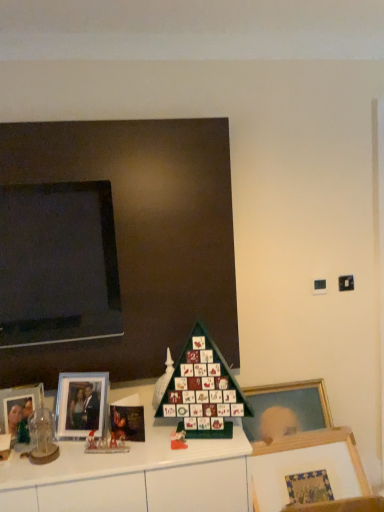
The image size is (384, 512). What are the coordinates of `green matte advent calendar at center` in the screenshot? It's located at (203, 389).

The height and width of the screenshot is (512, 384). What do you see at coordinates (19, 405) in the screenshot? I see `matte glass picture frame at left, acting as the 3th picture frame starting from the right` at bounding box center [19, 405].

What are the coordinates of `green plastic advent calendar at center` in the screenshot? It's located at (133, 474).

Image resolution: width=384 pixels, height=512 pixels. What do you see at coordinates (305, 466) in the screenshot?
I see `wooden picture frame at lower right, placed as the first picture frame when sorted from right to left` at bounding box center [305, 466].

You are a GUI agent. You are given a task and a screenshot of the screen. Output one action in this format:
    pyautogui.click(x=<x>, y=<y>)
    Task: Click on the green matte advent calendar at center, which is counted as the second toy, starting from the right
    
    Given the screenshot: What is the action you would take?
    pyautogui.click(x=163, y=381)

What do you see at coordinates (42, 438) in the screenshot?
I see `clear glass dome at left, which appears as the 1th toy when viewed from the front` at bounding box center [42, 438].

In order to face matte plastic advent calendar at center, the 2th toy positioned from the front, should I rotate leftwards or rightwards?

Turn left approximately 1.716 degrees to face it.

The width and height of the screenshot is (384, 512). Find the location of `green matte advent calendar at center`. green matte advent calendar at center is located at coordinates (203, 389).

Between matte plastic advent calendar at center, the 2th toy positioned from the front, and green matte advent calendar at center, the 2th toy positioned from the left, which one appears on the left side from the viewer's perspective?

From the viewer's perspective, green matte advent calendar at center, the 2th toy positioned from the left, appears more on the left side.

From a real-world perspective, count 2nd toys downward from the green matte advent calendar at center, the 2th toy positioned from the left, and point to it. Please provide its 2D coordinates.

[(179, 438)]

How many degrees apart are the facing directions of matte plastic advent calendar at center, the second toy viewed from the back, and green matte advent calendar at center, the third toy viewed from the front?

The angle between the facing direction of matte plastic advent calendar at center, the second toy viewed from the back, and the facing direction of green matte advent calendar at center, the third toy viewed from the front, is 13 degrees.

From the image's perspective, is matte plastic advent calendar at center, the 3th toy when ordered from left to right, located above green matte advent calendar at center, the 2th toy positioned from the left?

Actually, matte plastic advent calendar at center, the 3th toy when ordered from left to right, appears below green matte advent calendar at center, the 2th toy positioned from the left, in the image.

In the scene shown: Considering the relative positions of green matte advent calendar at center, the 2th toy positioned from the left, and clear glass dome at left, which appears as the 1th toy when viewed from the front, in the image provided, is green matte advent calendar at center, the 2th toy positioned from the left, in front of clear glass dome at left, which appears as the 1th toy when viewed from the front,?

That is False.

Which object is positioned more to the left, green matte advent calendar at center, which is counted as the second toy, starting from the right, or clear glass dome at left, arranged as the 3th toy when viewed from the right?

From the viewer's perspective, clear glass dome at left, arranged as the 3th toy when viewed from the right, appears more on the left side.

Is clear glass dome at left, arranged as the 3th toy when viewed from the right, located within green matte advent calendar at center, which is counted as the second toy, starting from the right?

No, clear glass dome at left, arranged as the 3th toy when viewed from the right, is not inside green matte advent calendar at center, which is counted as the second toy, starting from the right.

I want to click on toy that is the 1st one below the green matte advent calendar at center, which is counted as the second toy, starting from the right (from a real-world perspective), so click(42, 438).

Considering the sizes of matte black board at upper left and matte glass picture frame at left, acting as the 3th picture frame starting from the right, in the image, is matte black board at upper left wider or thinner than matte glass picture frame at left, acting as the 3th picture frame starting from the right,?

Considering their sizes, matte black board at upper left looks broader than matte glass picture frame at left, acting as the 3th picture frame starting from the right.

Is matte black board at upper left aimed at matte glass picture frame at left, acting as the 3th picture frame starting from the right?

Yes, matte black board at upper left is turned towards matte glass picture frame at left, acting as the 3th picture frame starting from the right.

From a real-world perspective, relative to matte glass picture frame at left, positioned as the first picture frame in left-to-right order, is matte black board at upper left vertically above or below?

Clearly, from a real-world perspective, matte black board at upper left is above matte glass picture frame at left, positioned as the first picture frame in left-to-right order.

This screenshot has width=384, height=512. What are the coordinates of `bulletin board behind the matte glass picture frame at left, acting as the 3th picture frame starting from the right` in the screenshot? It's located at (140, 236).

Is matte plastic advent calendar at center, which ranks as the 1th toy in right-to-left order, inside the boundaries of matte black board at upper left, or outside?

matte plastic advent calendar at center, which ranks as the 1th toy in right-to-left order, is outside matte black board at upper left.

How different are the orientations of matte plastic advent calendar at center, the second toy viewed from the back, and matte black board at upper left in degrees?

matte plastic advent calendar at center, the second toy viewed from the back, and matte black board at upper left are facing 13.9 degrees away from each other.

Which is in front, matte plastic advent calendar at center, which ranks as the 1th toy in right-to-left order, or matte black board at upper left?

matte plastic advent calendar at center, which ranks as the 1th toy in right-to-left order, is more forward.

Considering the relative sizes of matte plastic advent calendar at center, which ranks as the 1th toy in right-to-left order, and matte black board at upper left in the image provided, is matte plastic advent calendar at center, which ranks as the 1th toy in right-to-left order, taller than matte black board at upper left?

No.

Which is closer to the camera, (176, 441) or (20, 494)?

Point (176, 441).

Is matte plastic advent calendar at center, which ranks as the 1th toy in right-to-left order, bigger than green plastic advent calendar at center?

Actually, matte plastic advent calendar at center, which ranks as the 1th toy in right-to-left order, might be smaller than green plastic advent calendar at center.

Which of these two, matte plastic advent calendar at center, the second toy viewed from the back, or green plastic advent calendar at center, is thinner?

matte plastic advent calendar at center, the second toy viewed from the back.

From the picture: Is matte black board at upper left inside the boundaries of matte glass picture frame at left, which appears as the second picture frame when viewed from the right, or outside?

matte black board at upper left exists outside the volume of matte glass picture frame at left, which appears as the second picture frame when viewed from the right.

Which of these two, matte black board at upper left or matte glass picture frame at left, which appears as the second picture frame when viewed from the right, is smaller?

With smaller size is matte glass picture frame at left, which appears as the second picture frame when viewed from the right.

In the scene shown: In the image, is matte black board at upper left positioned in front of or behind matte glass picture frame at left, which is the second picture frame from left to right?

matte black board at upper left is behind matte glass picture frame at left, which is the second picture frame from left to right.

Is matte black board at upper left next to matte glass picture frame at left, which is the second picture frame from left to right, and touching it?

No, matte black board at upper left is not in contact with matte glass picture frame at left, which is the second picture frame from left to right.

Considering the sizes of objects clear glass dome at left, which appears as the 1th toy when viewed from the front, and matte glass picture frame at left, which appears as the second picture frame when viewed from the right, in the image provided, who is wider, clear glass dome at left, which appears as the 1th toy when viewed from the front, or matte glass picture frame at left, which appears as the second picture frame when viewed from the right,?

Wider between the two is clear glass dome at left, which appears as the 1th toy when viewed from the front.

Looking at this image, does clear glass dome at left, arranged as the 3th toy when viewed from the right, have a smaller size compared to matte glass picture frame at left, which is the second picture frame from left to right?

Indeed, clear glass dome at left, arranged as the 3th toy when viewed from the right, has a smaller size compared to matte glass picture frame at left, which is the second picture frame from left to right.

I want to click on the 3rd picture frame behind when counting from the clear glass dome at left, the first toy from the left, so click(82, 405).

Find the location of a particular element. toy on the right of green matte advent calendar at center, which is counted as the second toy, starting from the right is located at coordinates pyautogui.click(x=179, y=438).

The height and width of the screenshot is (512, 384). In order to click on toy above the clear glass dome at left, which appears as the 1th toy when viewed from the front (from the image's perspective) in this screenshot , I will do `click(163, 381)`.

Estimate the real-world distances between objects in this image. Which object is further from matte glass picture frame at left, which is the second picture frame from left to right, clear glass dome at left, the first toy from the left, or green matte advent calendar at center?

green matte advent calendar at center lies further to matte glass picture frame at left, which is the second picture frame from left to right, than the other object.

Looking at this image, looking at the image, which one is located further to matte glass picture frame at left, which is the second picture frame from left to right, matte glass picture frame at left, positioned as the first picture frame in left-to-right order, or green plastic advent calendar at center?

green plastic advent calendar at center is further to matte glass picture frame at left, which is the second picture frame from left to right.

Estimate the real-world distances between objects in this image. Which object is further from clear glass dome at left, arranged as the third toy when viewed from the back, green matte advent calendar at center or green matte advent calendar at center, which is counted as the second toy, starting from the right?

green matte advent calendar at center is positioned further to the anchor clear glass dome at left, arranged as the third toy when viewed from the back.

Looking at the image, which one is located closer to matte plastic advent calendar at center, which ranks as the 1th toy in right-to-left order, green matte advent calendar at center, which ranks as the first toy in back-to-front order, or matte glass picture frame at left, which appears as the second picture frame when viewed from the right?

green matte advent calendar at center, which ranks as the first toy in back-to-front order, lies closer to matte plastic advent calendar at center, which ranks as the 1th toy in right-to-left order, than the other object.

Which object lies nearer to the anchor point matte black board at upper left, green plastic advent calendar at center or matte plastic advent calendar at center, which ranks as the 1th toy in right-to-left order?

Based on the image, green plastic advent calendar at center appears to be nearer to matte black board at upper left.

In the scene shown: Considering their positions, is green matte advent calendar at center positioned further to matte plastic advent calendar at center, which ranks as the 1th toy in right-to-left order, than clear glass dome at left, arranged as the third toy when viewed from the back?

Based on the image, clear glass dome at left, arranged as the third toy when viewed from the back, appears to be further to matte plastic advent calendar at center, which ranks as the 1th toy in right-to-left order.

Based on their spatial positions, is wooden picture frame at lower right, placed as the first picture frame when sorted from right to left, or matte glass picture frame at left, acting as the 3th picture frame starting from the right, closer to matte plastic advent calendar at center, the second toy viewed from the back?

wooden picture frame at lower right, placed as the first picture frame when sorted from right to left.

Estimate the real-world distances between objects in this image. Which object is further from matte plastic advent calendar at center, the second toy viewed from the back, wooden picture frame at lower right, placed as the first picture frame when sorted from right to left, or green plastic advent calendar at center?

wooden picture frame at lower right, placed as the first picture frame when sorted from right to left, lies further to matte plastic advent calendar at center, the second toy viewed from the back, than the other object.

Locate an element on the screen. picture frame situated between clear glass dome at left, which appears as the 1th toy when viewed from the front, and matte plastic advent calendar at center, the 2th toy positioned from the front, from left to right is located at coordinates (82, 405).

Find the location of `furniture located between matte glass picture frame at left, positioned as the first picture frame in left-to-right order, and green matte advent calendar at center in the left-right direction`. furniture located between matte glass picture frame at left, positioned as the first picture frame in left-to-right order, and green matte advent calendar at center in the left-right direction is located at coordinates (133, 474).

At what (x,y) coordinates should I click in order to perform the action: click on bulletin board between matte glass picture frame at left, acting as the 3th picture frame starting from the right, and green matte advent calendar at center. Please return your answer as a coordinate pair (x, y). Looking at the image, I should click on (140, 236).

This screenshot has height=512, width=384. In order to click on toy between matte glass picture frame at left, acting as the 3th picture frame starting from the right, and matte glass picture frame at left, which is the second picture frame from left to right, in the horizontal direction in this screenshot , I will do `click(42, 438)`.